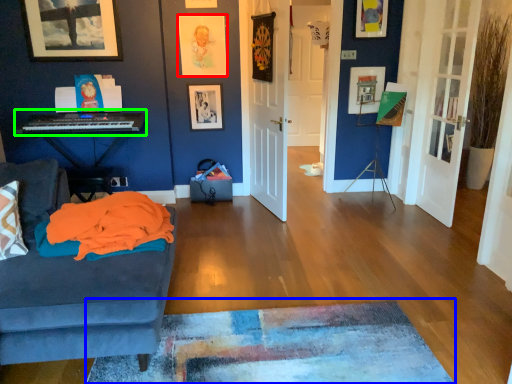
Question: Based on their relative distances, which object is nearer to picture frame (highlighted by a red box)? Choose from plain (highlighted by a blue box) and musical keyboard (highlighted by a green box).

Choices:
 (A) plain
 (B) musical keyboard

Answer: (B)